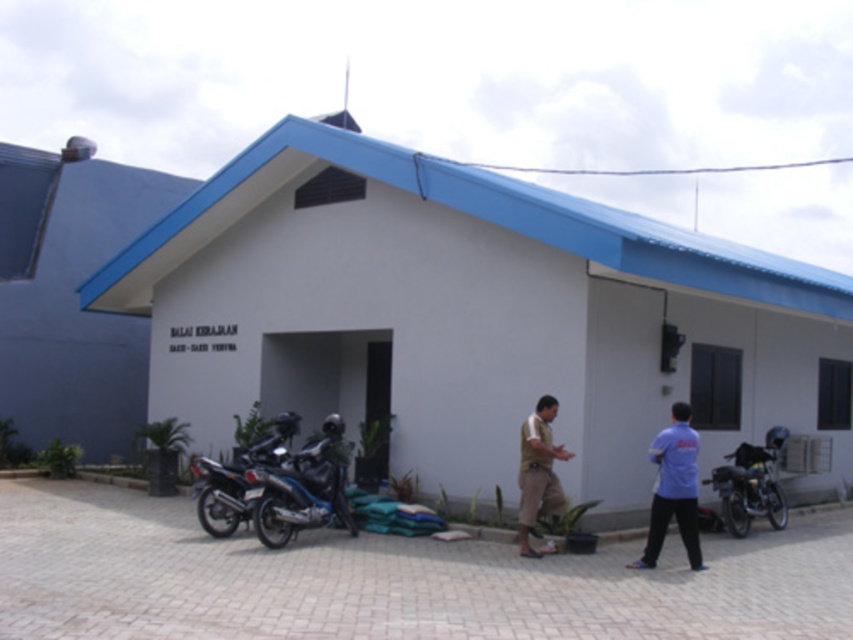
You are a delivery person who needs to load a brown cotton shirt at center onto the shiny metallic motorcycle at lower left. Given that the motorcycle is larger, will the shirt fit on it?

The shiny metallic motorcycle at lower left is larger in size than the brown cotton shirt at center, so yes, the shirt will fit on the motorcycle.

You are a delivery person who needs to place a package between the blue cotton shirt at center and the brown cotton shirt at center. The package requires 1.5 meters of space. Can you fit it between them?

The blue cotton shirt at center and brown cotton shirt at center are 1.37 meters apart from each other. Since the required space is 1.5 meters, the package cannot fit between them.

You are a delivery person who needs to place a package on top of the blue cotton shirt at center without touching the shiny metallic motorcycle at lower left. Is this possible given their sizes?

The blue cotton shirt at center is taller than the shiny metallic motorcycle at lower left, so yes, the package can be placed on top of the blue cotton shirt at center without touching the motorcycle.